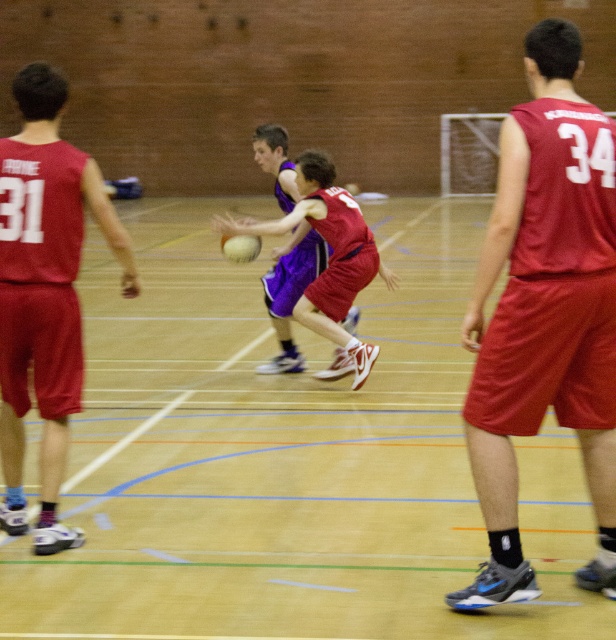
Can you confirm if matte red jersey at right is positioned above matte red jersey at left?

No.

At what (x,y) coordinates should I click in order to perform the action: click on matte red jersey at right. Please return your answer as a coordinate pair (x, y). The width and height of the screenshot is (616, 640). Looking at the image, I should click on (545, 312).

In order to click on matte red jersey at right in this screenshot , I will do 545,312.

Does point (501, 209) come behind point (331, 304)?

No, it is not.

You are a GUI agent. You are given a task and a screenshot of the screen. Output one action in this format:
    pyautogui.click(x=<x>, y=<y>)
    Task: Click on the matte red jersey at right
    Image resolution: width=616 pixels, height=640 pixels.
    Given the screenshot: What is the action you would take?
    pyautogui.click(x=545, y=312)

Find the location of a particular element. matte red jersey at right is located at coordinates (545, 312).

Who is more forward, (513, 356) or (222, 250)?

Point (513, 356) is in front.

Who is lower down, matte red jersey at right or glossy rubber basketball at center?

matte red jersey at right is lower down.

Between point (511, 262) and point (249, 260), which one is positioned in front?

Point (511, 262) is in front.

Where is `matte red jersey at right`? Image resolution: width=616 pixels, height=640 pixels. matte red jersey at right is located at coordinates (545, 312).